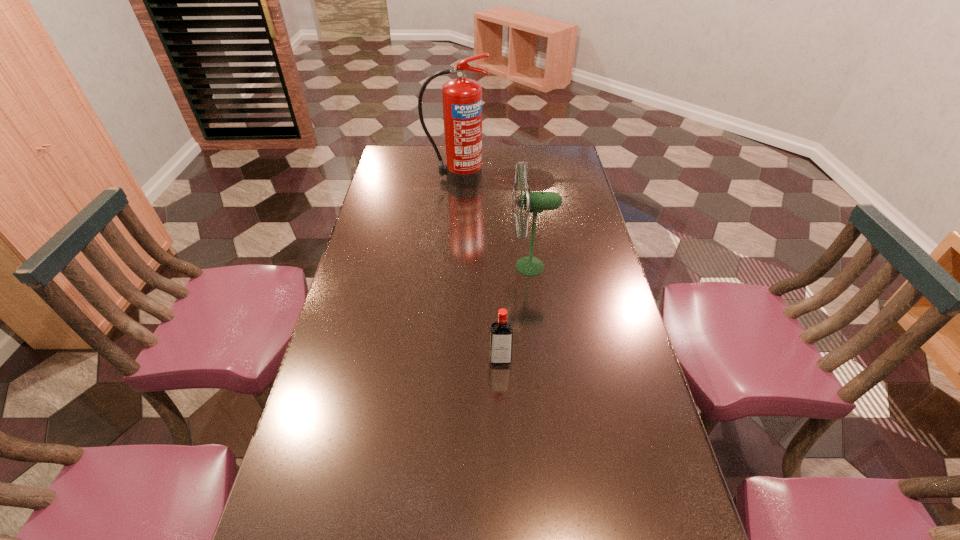
Find the location of a particular element. free region located on the front and back of the shortest object is located at coordinates (507, 531).

The width and height of the screenshot is (960, 540). I want to click on object that is at the far edge, so click(462, 98).

Locate an element on the screen. The image size is (960, 540). free space at the far edge of the desktop is located at coordinates (520, 146).

In the image, there is a desktop. Where is `vacant space at the left edge`? vacant space at the left edge is located at coordinates (335, 383).

This screenshot has height=540, width=960. I want to click on vacant point at the right edge, so click(564, 264).

You are a GUI agent. You are given a task and a screenshot of the screen. Output one action in this format:
    pyautogui.click(x=<x>, y=<y>)
    Task: Click on the vacant space at the far right corner of the desktop
    This screenshot has height=540, width=960.
    Given the screenshot: What is the action you would take?
    [x=576, y=157]

The image size is (960, 540). I want to click on free area in between the tallest object and the vodka, so click(478, 269).

Where is `unoccupied area between the shortest object and the tallest object`? unoccupied area between the shortest object and the tallest object is located at coordinates (478, 269).

Where is `free space between the shortest object and the fire extinguisher`? free space between the shortest object and the fire extinguisher is located at coordinates (478, 269).

Find the location of a particular element. This screenshot has height=540, width=960. free space between the second nearest object and the tallest object is located at coordinates [x=493, y=222].